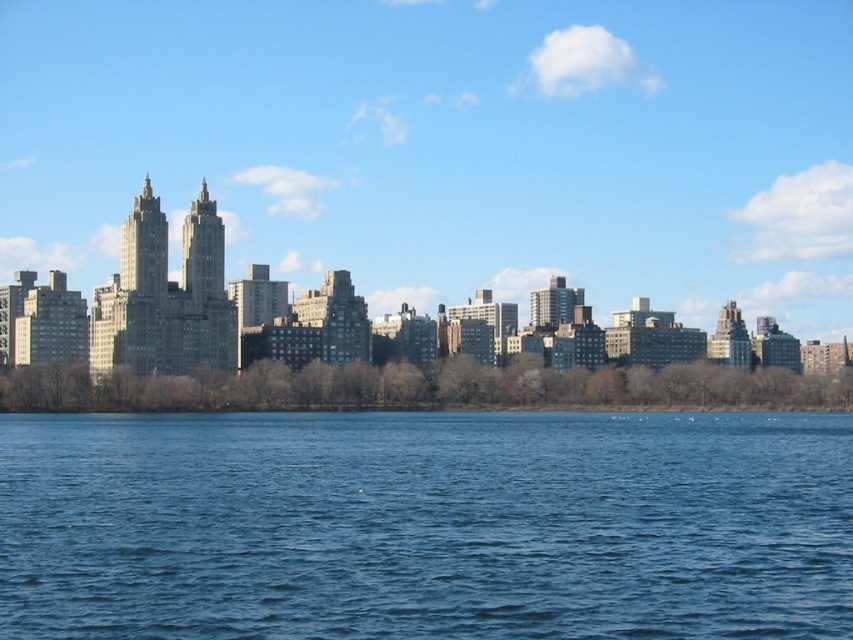
Question: Estimate the real-world distances between objects in this image. Which object is closer to the blue liquid water at center?

Choices:
 (A) transparent glass buildings at center
 (B) gray concrete buildings at center

Answer: (B)

Question: Can you confirm if transparent glass buildings at center is smaller than blue liquid water at center?

Choices:
 (A) no
 (B) yes

Answer: (A)

Question: Can you confirm if transparent glass buildings at center is wider than gray concrete buildings at center?

Choices:
 (A) yes
 (B) no

Answer: (A)

Question: Is transparent glass buildings at center to the left of blue liquid water at center from the viewer's perspective?

Choices:
 (A) no
 (B) yes

Answer: (A)

Question: Which of the following is the closest to the observer?

Choices:
 (A) transparent glass buildings at center
 (B) gray concrete buildings at center

Answer: (B)

Question: Which point is closer to the camera?

Choices:
 (A) blue liquid water at center
 (B) gray concrete buildings at center
 (C) transparent glass buildings at center

Answer: (A)